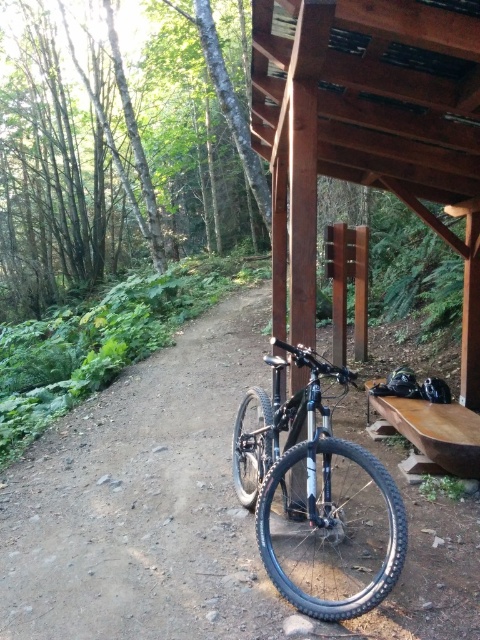
Where is `dirt path at center`? dirt path at center is located at coordinates (144, 500).

Between dirt path at center and shiny black mountain bike at center, which one has less height?

With less height is dirt path at center.

Is point (44, 605) more distant than point (343, 572)?

No, (44, 605) is in front of (343, 572).

Where is `dirt path at center`? This screenshot has width=480, height=640. dirt path at center is located at coordinates (144, 500).

Does point (224, 577) come behind point (276, 195)?

No, it is in front of (276, 195).

Locate an element on the screen. dirt path at center is located at coordinates (144, 500).

Can you confirm if brown wooden shelter at upper center is positioned above shiny black mountain bike at center?

Yes, brown wooden shelter at upper center is above shiny black mountain bike at center.

How distant is brown wooden shelter at upper center from shiny black mountain bike at center?

brown wooden shelter at upper center and shiny black mountain bike at center are 1.05 meters apart from each other.

Does point (309, 209) come in front of point (336, 458)?

Yes, point (309, 209) is closer to viewer.

Where is `brown wooden shelter at upper center`? The height and width of the screenshot is (640, 480). brown wooden shelter at upper center is located at coordinates (370, 129).